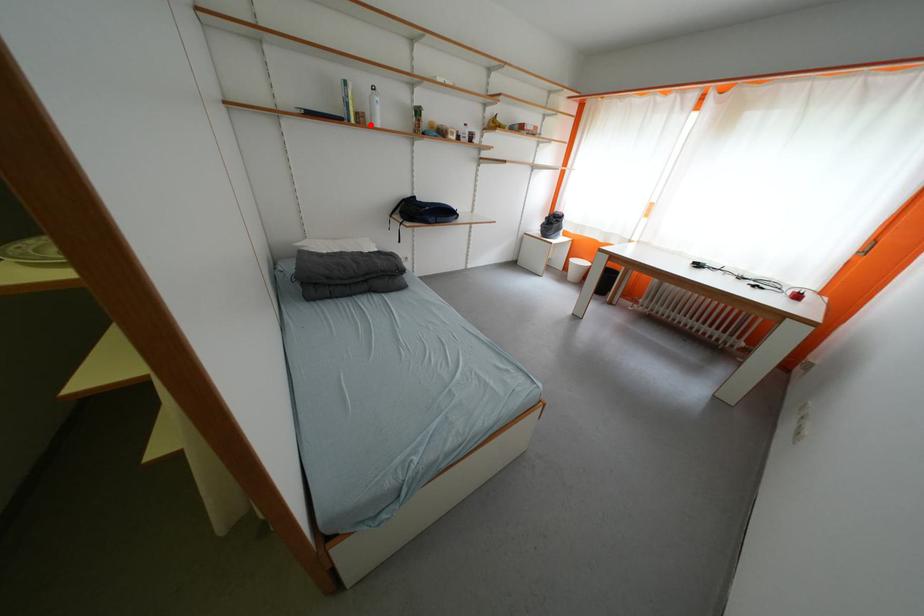
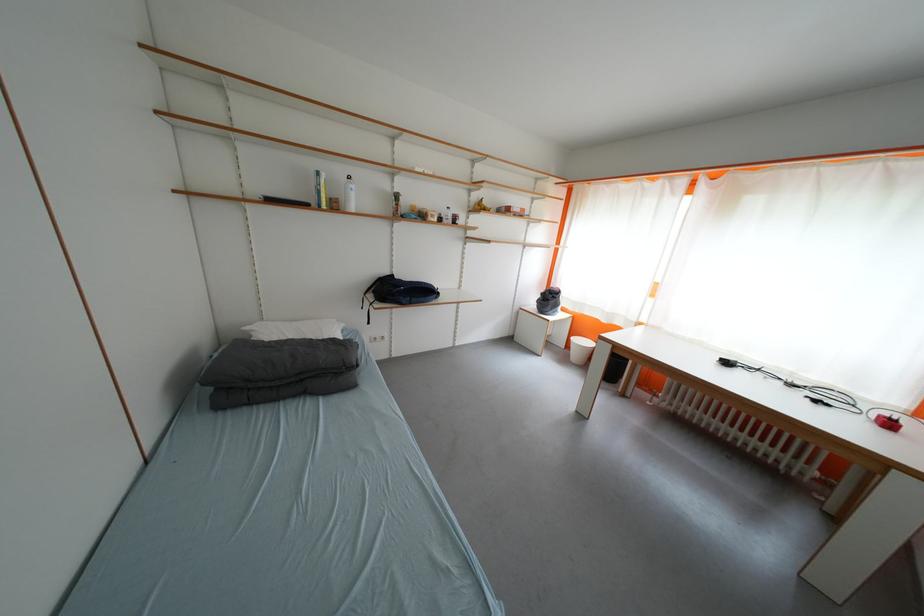
Where in the second image is the point corresponding to the highlighted location from the first image?

(344, 209)